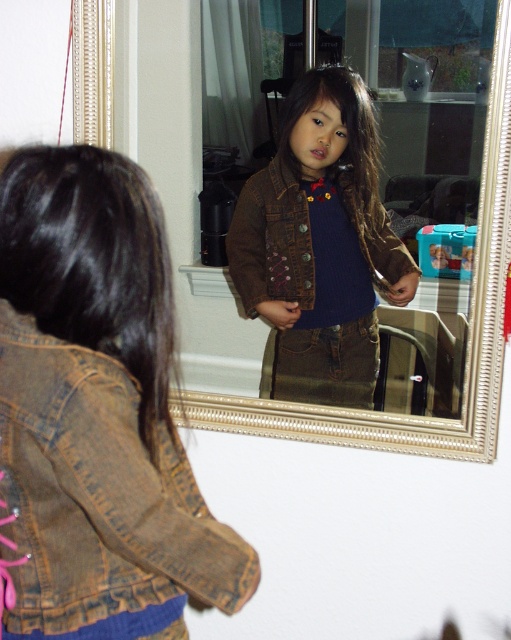
Question: Which object appears closest to the camera in this image?

Choices:
 (A) denim jacket at lower left
 (B) brown denim jacket at center
 (C) brushed metal mirror at center

Answer: (A)

Question: Which of the following is the closest to the observer?

Choices:
 (A) (413, 332)
 (B) (247, 244)

Answer: (A)

Question: Is brown denim jacket at center bigger than brushed metal mirror at center?

Choices:
 (A) yes
 (B) no

Answer: (A)

Question: Which point is closer to the camera?

Choices:
 (A) (403, 365)
 (B) (285, 291)

Answer: (A)

Question: Observing the image, what is the correct spatial positioning of denim jacket at lower left in reference to brown denim jacket at center?

Choices:
 (A) above
 (B) below

Answer: (B)

Question: Does brown denim jacket at center have a greater width compared to brushed metal mirror at center?

Choices:
 (A) no
 (B) yes

Answer: (B)